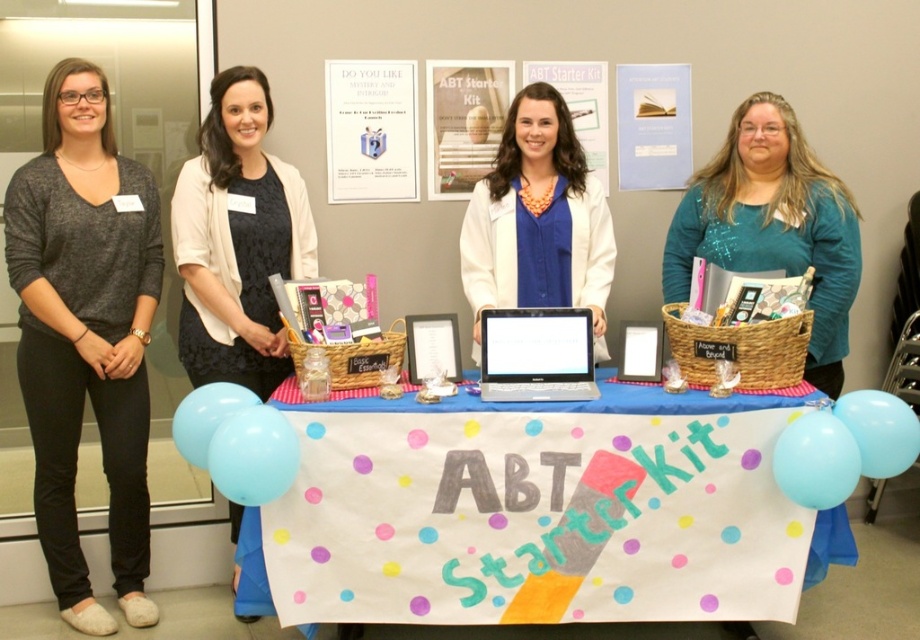
Who is lower down, teal glittery sweater at center or light blue balloon at lower left?

light blue balloon at lower left

Which of these two, teal glittery sweater at center or light blue balloon at lower left, stands shorter?

Standing shorter between the two is light blue balloon at lower left.

In the scene shown: Who is more forward, (813, 300) or (232, 413)?

Point (232, 413) is more forward.

Identify the location of teal glittery sweater at center. The height and width of the screenshot is (640, 920). (772, 225).

Is teal glittery sweater at center in front of silver metallic laptop at center?

No, it is not.

Does teal glittery sweater at center appear on the left side of silver metallic laptop at center?

Incorrect, teal glittery sweater at center is not on the left side of silver metallic laptop at center.

The width and height of the screenshot is (920, 640). In order to click on teal glittery sweater at center in this screenshot , I will do `click(772, 225)`.

You are a GUI agent. You are given a task and a screenshot of the screen. Output one action in this format:
    pyautogui.click(x=<x>, y=<y>)
    Task: Click on the matte white lab coat at center
    The image size is (920, 640).
    Given the screenshot: What is the action you would take?
    pyautogui.click(x=538, y=220)

Who is shorter, matte white lab coat at center or light blue rubber balloon at lower left?

Standing shorter between the two is light blue rubber balloon at lower left.

Find the location of a particular element. matte white lab coat at center is located at coordinates (538, 220).